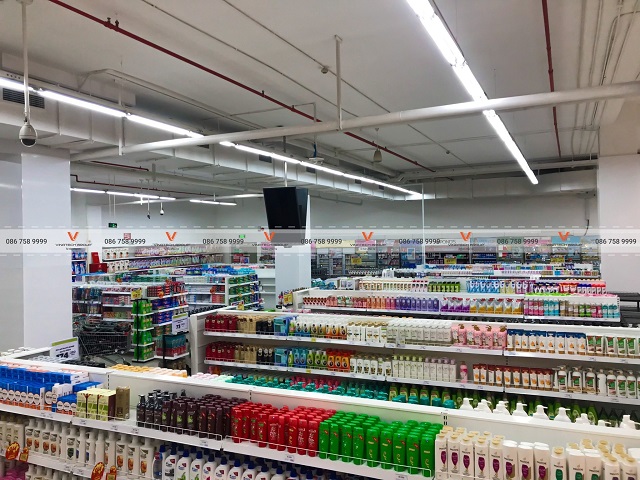
You are a GUI agent. You are given a task and a screenshot of the screen. Output one action in this format:
    pyautogui.click(x=<x>, y=<y>)
    Task: Click on the ceiling
    The image size is (640, 480).
    Given the screenshot: What is the action you would take?
    pyautogui.click(x=436, y=83)